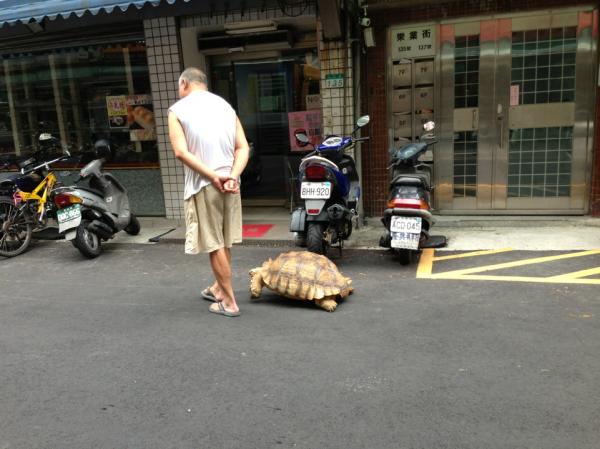
I want to click on door mat, so [257, 228].